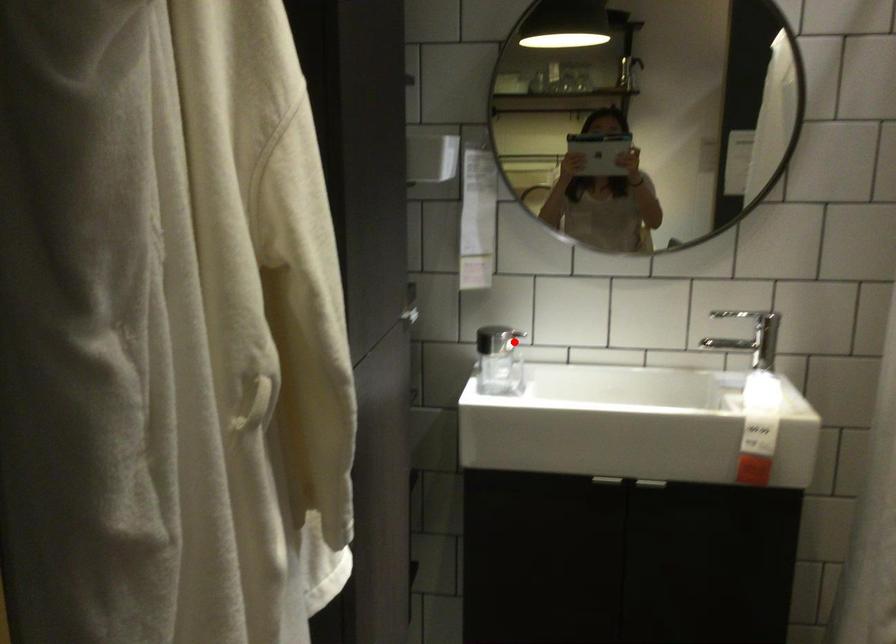
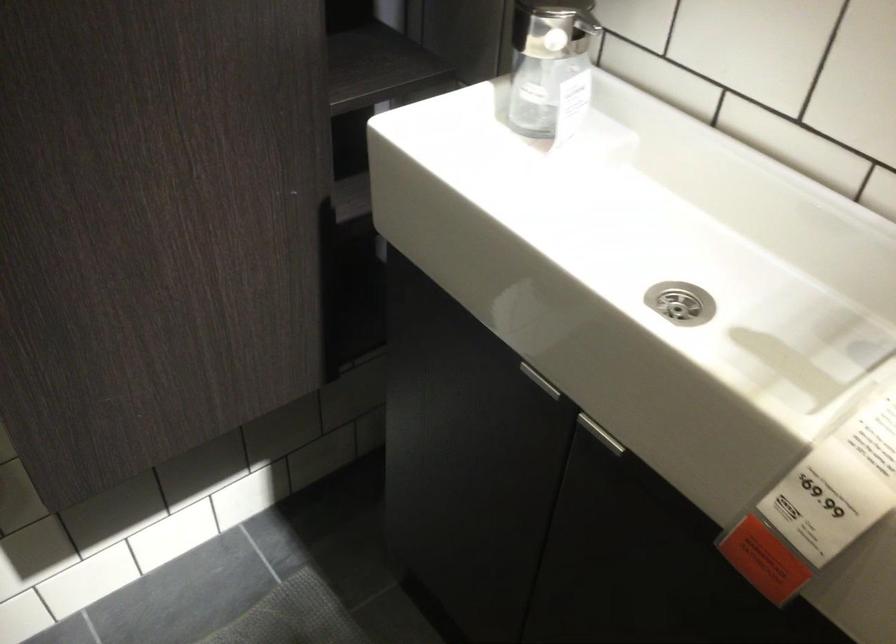
Question: I am providing you with two images of the same scene from different viewpoints. Given a red point in image1, look at the same physical point in image2. Is it:

Choices:
 (A) Closer to the viewpoint
 (B) Farther from the viewpoint

Answer: (A)